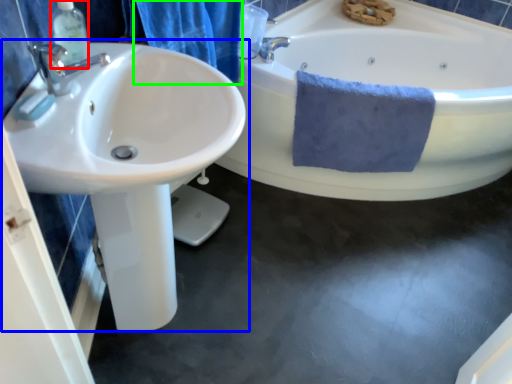
Question: Which is farther away from soap dispenser (highlighted by a red box)? sink (highlighted by a blue box) or shower curtain (highlighted by a green box)?

Choices:
 (A) sink
 (B) shower curtain

Answer: (B)